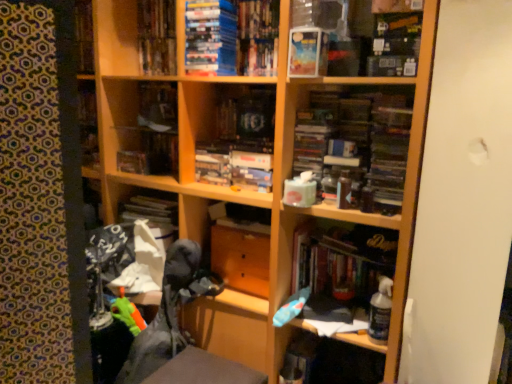
Describe the element at coordinates (157, 37) in the screenshot. I see `hardcover books at upper center, marked as the first book in a top-to-bottom arrangement` at that location.

This screenshot has height=384, width=512. What do you see at coordinates (231, 37) in the screenshot? I see `matte plastic book at upper center, the 3th book viewed from the left` at bounding box center [231, 37].

The width and height of the screenshot is (512, 384). In order to click on wooden drawer at center in this screenshot , I will do `click(241, 259)`.

Find the location of `hardcover book at center, which is the 1th book in bottom-to-top order`. hardcover book at center, which is the 1th book in bottom-to-top order is located at coordinates (342, 261).

Considering the relative positions of hardcover books at upper center, the 3th book from the right, and wooden drawer at center in the image provided, is hardcover books at upper center, the 3th book from the right, to the right of wooden drawer at center from the viewer's perspective?

No, hardcover books at upper center, the 3th book from the right, is not to the right of wooden drawer at center.

The height and width of the screenshot is (384, 512). I want to click on drawer directly beneath the hardcover books at upper center, the 2th book from the left (from a real-world perspective), so click(241, 259).

Does hardcover books at upper center, placed as the fourth book when sorted from bottom to top, lie behind wooden drawer at center?

Yes, the depth of hardcover books at upper center, placed as the fourth book when sorted from bottom to top, is greater than that of wooden drawer at center.

Which of these two, matte plastic book at center, acting as the 4th book starting from the right, or hardcover books at upper center, the 3th book from the right, stands taller?

hardcover books at upper center, the 3th book from the right.

Can you tell me how much matte plastic book at center, acting as the 4th book starting from the right, and hardcover books at upper center, marked as the first book in a top-to-bottom arrangement, differ in facing direction?

0.00107 degrees.

The width and height of the screenshot is (512, 384). I want to click on book that appears on the left of hardcover books at upper center, placed as the fourth book when sorted from bottom to top, so click(148, 153).

Can you confirm if matte plastic book at center, which ranks as the 2th book in bottom-to-top order, is bigger than hardcover books at upper center, placed as the fourth book when sorted from bottom to top?

Actually, matte plastic book at center, which ranks as the 2th book in bottom-to-top order, might be smaller than hardcover books at upper center, placed as the fourth book when sorted from bottom to top.

From a real-world perspective, is hardcover book at center, which appears as the fourth book when viewed from the top, under matte plastic book at center, which ranks as the 2th book in bottom-to-top order?

Yes, from a real-world perspective, hardcover book at center, which appears as the fourth book when viewed from the top, is under matte plastic book at center, which ranks as the 2th book in bottom-to-top order.

Is hardcover book at center, which appears as the fourth book when viewed from the top, facing away from matte plastic book at center, the first book from the left?

No, hardcover book at center, which appears as the fourth book when viewed from the top,'s orientation is not away from matte plastic book at center, the first book from the left.

Considering the positions of point (362, 292) and point (129, 161), is point (362, 292) closer or farther from the camera than point (129, 161)?

Point (362, 292).

Would you say wooden drawer at center is part of matte plastic paperback book at upper center's contents?

No, matte plastic paperback book at upper center does not contain wooden drawer at center.

Between matte plastic paperback book at upper center and wooden drawer at center, which one is positioned behind?

wooden drawer at center is more distant.

Who is shorter, matte plastic paperback book at upper center or wooden drawer at center?

matte plastic paperback book at upper center.

Looking at this image, could you tell me if matte plastic paperback book at upper center is turned towards wooden drawer at center?

No, matte plastic paperback book at upper center does not turn towards wooden drawer at center.

Based on the photo, does matte plastic book at upper center, the 3th book viewed from the left, have a lesser width compared to wooden drawer at center?

Correct, the width of matte plastic book at upper center, the 3th book viewed from the left, is less than that of wooden drawer at center.

Is matte plastic book at upper center, the 2th book in the top-to-bottom sequence, far from wooden drawer at center?

No, matte plastic book at upper center, the 2th book in the top-to-bottom sequence, is not far away from wooden drawer at center.

Measure the distance between matte plastic book at upper center, the 3th book viewed from the left, and wooden drawer at center.

They are 32.66 inches apart.

Between matte plastic paperback book at upper center and hardcover books at upper center, the 2th book from the left, which one is positioned in front?

Positioned in front is matte plastic paperback book at upper center.

From a real-world perspective, between matte plastic paperback book at upper center and hardcover books at upper center, the 2th book from the left, who is vertically higher?

hardcover books at upper center, the 2th book from the left, from a real-world perspective.

Considering the sizes of matte plastic paperback book at upper center and hardcover books at upper center, the 2th book from the left, in the image, is matte plastic paperback book at upper center wider or thinner than hardcover books at upper center, the 2th book from the left,?

Clearly, matte plastic paperback book at upper center has more width compared to hardcover books at upper center, the 2th book from the left.

Is matte plastic paperback book at upper center shorter than hardcover books at upper center, the 3th book from the right?

Correct, matte plastic paperback book at upper center is not as tall as hardcover books at upper center, the 3th book from the right.

From the image's perspective, does matte plastic book at upper center, the third book from the bottom, appear lower than matte plastic book at center, which ranks as the 2th book in bottom-to-top order?

Actually, matte plastic book at upper center, the third book from the bottom, appears above matte plastic book at center, which ranks as the 2th book in bottom-to-top order, in the image.

In the image, is matte plastic book at upper center, which ranks as the 2th book in right-to-left order, positioned in front of or behind matte plastic book at center, which ranks as the 2th book in bottom-to-top order?

matte plastic book at upper center, which ranks as the 2th book in right-to-left order, is positioned closer to the viewer than matte plastic book at center, which ranks as the 2th book in bottom-to-top order.

Considering the relative sizes of matte plastic book at upper center, the 3th book viewed from the left, and matte plastic book at center, arranged as the 3th book when viewed from the top, in the image provided, is matte plastic book at upper center, the 3th book viewed from the left, thinner than matte plastic book at center, arranged as the 3th book when viewed from the top,?

In fact, matte plastic book at upper center, the 3th book viewed from the left, might be wider than matte plastic book at center, arranged as the 3th book when viewed from the top.

From the image's perspective, count 3rd books upward from the wooden drawer at center and point to it. Please provide its 2D coordinates.

[(157, 37)]

The image size is (512, 384). In order to click on the 2nd book positioned above the matte plastic book at center, acting as the 4th book starting from the right (from a real-world perspective) in this screenshot , I will do `click(157, 37)`.

When comparing their distances from hardcover book at center, the fourth book from the left, does matte plastic book at center, which ranks as the 2th book in bottom-to-top order, or wooden drawer at center seem further?

matte plastic book at center, which ranks as the 2th book in bottom-to-top order, is positioned further to the anchor hardcover book at center, the fourth book from the left.

Estimate the real-world distances between objects in this image. Which object is further from hardcover books at upper center, the 3th book from the right, plush gray swivel chair at lower left or wooden drawer at center?

Among the two, plush gray swivel chair at lower left is located further to hardcover books at upper center, the 3th book from the right.

Based on their spatial positions, is wooden drawer at center or matte plastic book at center, arranged as the 3th book when viewed from the top, further from hardcover book at center, which appears as the fourth book when viewed from the top?

Among the two, matte plastic book at center, arranged as the 3th book when viewed from the top, is located further to hardcover book at center, which appears as the fourth book when viewed from the top.

Estimate the real-world distances between objects in this image. Which object is further from matte plastic paperback book at upper center, hardcover book at center, which appears as the fourth book when viewed from the top, or matte plastic book at center, the first book from the left?

matte plastic book at center, the first book from the left.

Which object lies further to the anchor point matte plastic paperback book at upper center, plush gray swivel chair at lower left or matte plastic book at center, the first book from the left?

Among the two, plush gray swivel chair at lower left is located further to matte plastic paperback book at upper center.

From the image, which object appears to be farther from plush gray swivel chair at lower left, matte plastic book at center, acting as the 4th book starting from the right, or matte plastic paperback book at upper center?

matte plastic paperback book at upper center lies further to plush gray swivel chair at lower left than the other object.

Consider the image. When comparing their distances from hardcover book at center, the fourth book from the left, does matte plastic paperback book at upper center or matte plastic book at center, arranged as the 3th book when viewed from the top, seem closer?

matte plastic paperback book at upper center lies closer to hardcover book at center, the fourth book from the left, than the other object.

Which object lies further to the anchor point matte plastic book at center, acting as the 4th book starting from the right, plush gray swivel chair at lower left or hardcover book at center, which is the 1th book in bottom-to-top order?

hardcover book at center, which is the 1th book in bottom-to-top order, is positioned further to the anchor matte plastic book at center, acting as the 4th book starting from the right.

Identify the location of drawer between matte plastic paperback book at upper center and plush gray swivel chair at lower left in the up-down direction. This screenshot has height=384, width=512. (241, 259).

Identify the location of book between matte plastic paperback book at upper center and wooden drawer at center in the vertical direction. This screenshot has width=512, height=384. (148, 153).

Where is `paperback book between matte plastic book at upper center, the 3th book viewed from the left, and plush gray swivel chair at lower left from top to bottom`? paperback book between matte plastic book at upper center, the 3th book viewed from the left, and plush gray swivel chair at lower left from top to bottom is located at coordinates (304, 52).

Find the location of `paperback book between hardcover books at upper center, the 3th book from the right, and hardcover book at center, which appears as the fourth book when viewed from the top, vertically`. paperback book between hardcover books at upper center, the 3th book from the right, and hardcover book at center, which appears as the fourth book when viewed from the top, vertically is located at coordinates (304, 52).